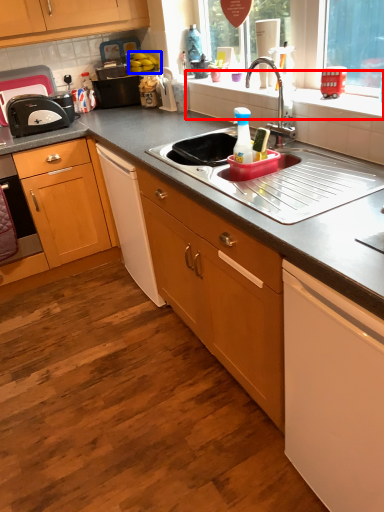
Question: Which object is further to the camera taking this photo, window sill (highlighted by a red box) or fruit (highlighted by a blue box)?

Choices:
 (A) window sill
 (B) fruit

Answer: (B)